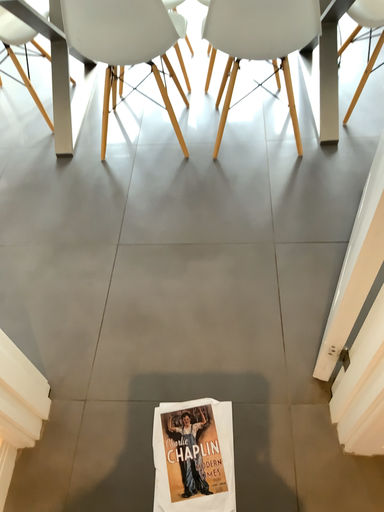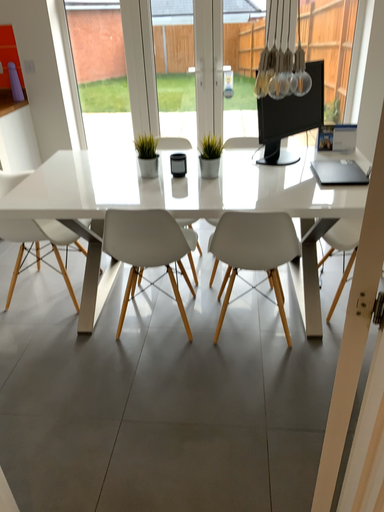
Question: How did the camera likely rotate when shooting the video?

Choices:
 (A) rotated upward
 (B) rotated downward

Answer: (A)